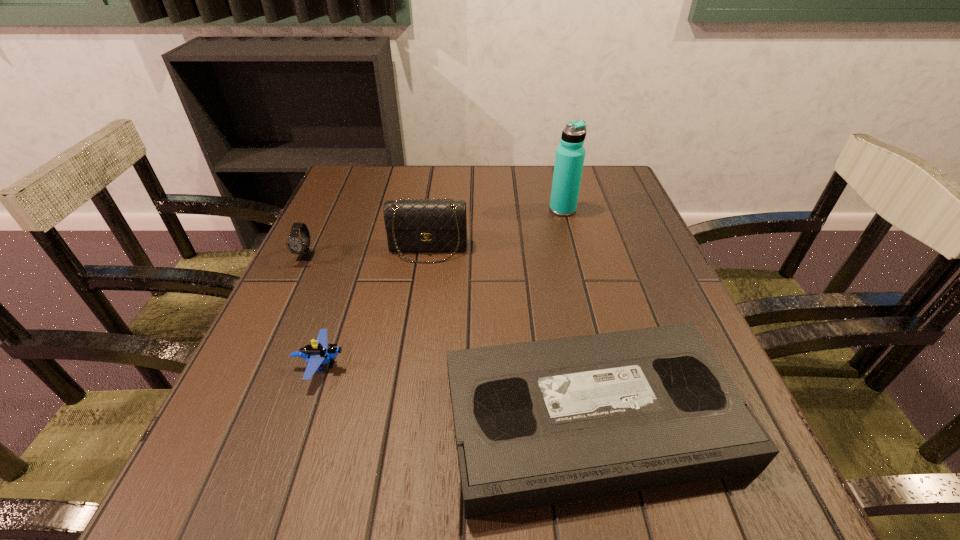
Where is `free region located on the front-facing side of the Lego`? Image resolution: width=960 pixels, height=540 pixels. free region located on the front-facing side of the Lego is located at coordinates [475, 364].

Identify the location of vacant region located 0.220m on the back of the videotape. (559, 266).

This screenshot has height=540, width=960. I want to click on object that is at the far edge, so click(x=569, y=160).

Identify the location of object situated at the near edge. The width and height of the screenshot is (960, 540). (539, 423).

Locate an element on the screen. The height and width of the screenshot is (540, 960). watch that is at the left edge is located at coordinates (296, 245).

Where is `Lego located in the left edge section of the desktop`? The height and width of the screenshot is (540, 960). Lego located in the left edge section of the desktop is located at coordinates (317, 353).

The width and height of the screenshot is (960, 540). In order to click on water bottle located at the right edge in this screenshot , I will do `click(569, 160)`.

Where is `videotape present at the right edge`? The width and height of the screenshot is (960, 540). videotape present at the right edge is located at coordinates (539, 423).

Where is `object at the far right corner`? object at the far right corner is located at coordinates (569, 160).

Where is `object that is positioned at the near right corner`? This screenshot has width=960, height=540. object that is positioned at the near right corner is located at coordinates (539, 423).